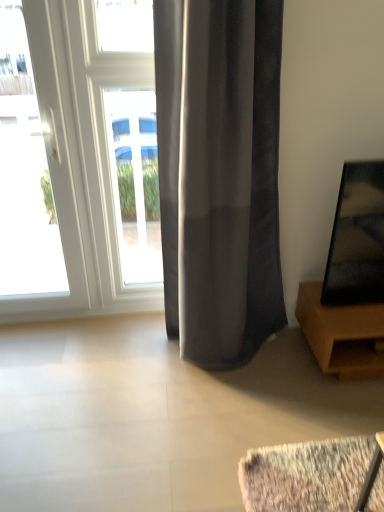
The width and height of the screenshot is (384, 512). Find the location of `vacant space in front of satin gray curtain at center`. vacant space in front of satin gray curtain at center is located at coordinates (243, 426).